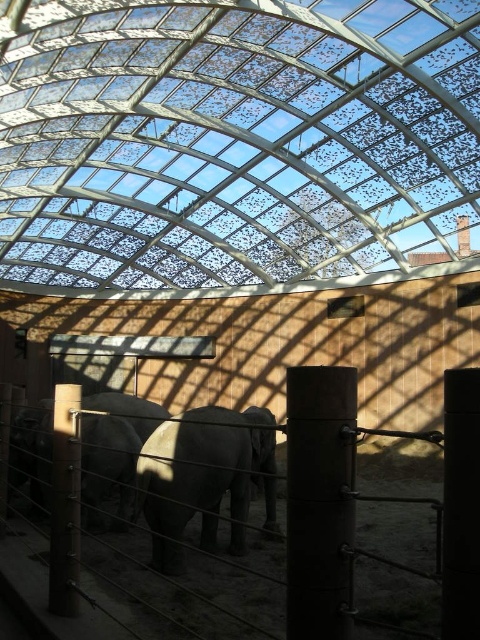
Can you confirm if brown metal fence at lower left is positioned to the right of gray matte elephant at center?

Indeed, brown metal fence at lower left is positioned on the right side of gray matte elephant at center.

Where is `brown metal fence at lower left`? This screenshot has height=640, width=480. brown metal fence at lower left is located at coordinates (300, 525).

Is point (351, 512) more distant than point (144, 451)?

No.

You are a GUI agent. You are given a task and a screenshot of the screen. Output one action in this format:
    pyautogui.click(x=<x>, y=<y>)
    Task: Click on the brown metal fence at lower left
    This screenshot has height=640, width=480.
    Given the screenshot: What is the action you would take?
    pyautogui.click(x=300, y=525)

Is brown metal fence at lower left further to the viewer compared to gray matte elephant at left?

No, brown metal fence at lower left is closer to the viewer.

Is point (475, 625) less distant than point (101, 468)?

Yes, it is.

You are a GUI agent. You are given a task and a screenshot of the screen. Output one action in this format:
    pyautogui.click(x=<x>, y=<y>)
    Task: Click on the brown metal fence at lower left
    This screenshot has width=480, height=640.
    Given the screenshot: What is the action you would take?
    pyautogui.click(x=300, y=525)

Where is `brown metal fence at lower left`? The width and height of the screenshot is (480, 640). brown metal fence at lower left is located at coordinates (300, 525).

Does gray matte elephant at center appear on the left side of gray matte elephant at left?

No, gray matte elephant at center is not to the left of gray matte elephant at left.

The height and width of the screenshot is (640, 480). I want to click on gray matte elephant at center, so click(x=201, y=476).